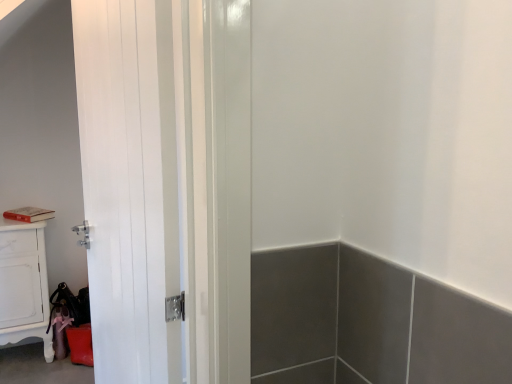
Question: From the image's perspective, is white glossy cabinet at lower left positioned above or below white glossy door at center?

Choices:
 (A) above
 (B) below

Answer: (B)

Question: Considering the relative positions of white glossy cabinet at lower left and white glossy door at center in the image provided, is white glossy cabinet at lower left to the left or to the right of white glossy door at center?

Choices:
 (A) left
 (B) right

Answer: (A)

Question: Is white glossy cabinet at lower left taller or shorter than white glossy door at center?

Choices:
 (A) tall
 (B) short

Answer: (B)

Question: From their relative heights in the image, would you say white glossy door at center is taller or shorter than white glossy cabinet at lower left?

Choices:
 (A) tall
 (B) short

Answer: (A)

Question: Considering the positions of point (x=186, y=168) and point (x=29, y=261), is point (x=186, y=168) closer or farther from the camera than point (x=29, y=261)?

Choices:
 (A) farther
 (B) closer

Answer: (B)

Question: Would you say white glossy door at center is to the left or to the right of white glossy cabinet at lower left in the picture?

Choices:
 (A) left
 (B) right

Answer: (B)

Question: Looking at the image, does white glossy door at center seem bigger or smaller compared to white glossy cabinet at lower left?

Choices:
 (A) big
 (B) small

Answer: (A)